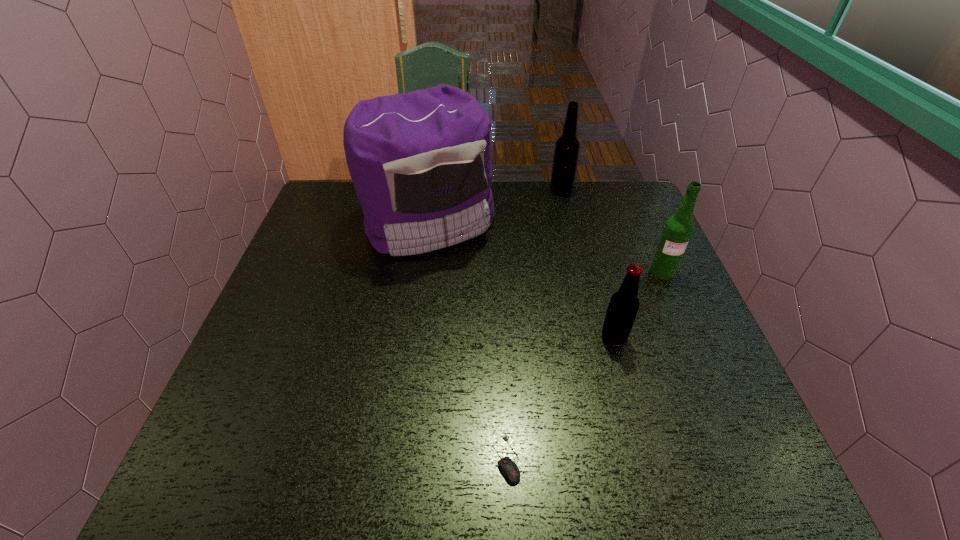
Identify the location of free space at the right edge. Image resolution: width=960 pixels, height=540 pixels. (679, 375).

Where is `vacant region at the far left corner of the desktop`? vacant region at the far left corner of the desktop is located at coordinates (312, 210).

At what (x,y) coordinates should I click in order to perform the action: click on vacant space at the near left corner. Please return your answer as a coordinate pair (x, y). Looking at the image, I should click on (204, 451).

What are the coordinates of `blank space at the far right corner` in the screenshot? It's located at (612, 205).

Where is `unoccupied position between the farthest beer bottle and the shortest object`? The width and height of the screenshot is (960, 540). unoccupied position between the farthest beer bottle and the shortest object is located at coordinates (534, 325).

Where is `free space between the tallest object and the shortest beer bottle`? free space between the tallest object and the shortest beer bottle is located at coordinates (521, 279).

Identify the location of blank region between the backpack and the shortest object. Image resolution: width=960 pixels, height=540 pixels. (468, 340).

Find the location of `unoccupied area between the farthest beer bottle and the nearest object`. unoccupied area between the farthest beer bottle and the nearest object is located at coordinates (534, 325).

Where is `empty location between the tallest object and the second shortest object`? empty location between the tallest object and the second shortest object is located at coordinates (521, 279).

Identify the location of free area in between the farthest beer bottle and the fourth farthest object. (588, 264).